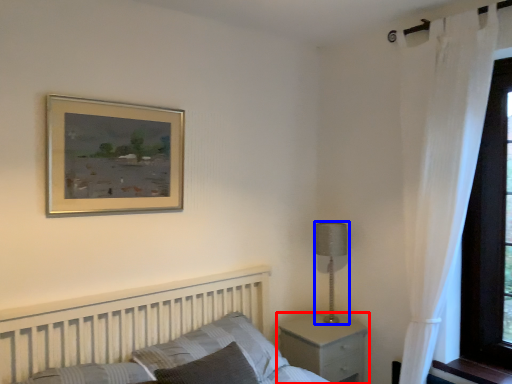
Question: Which object is further to the camera taking this photo, nightstand (highlighted by a red box) or table lamp (highlighted by a blue box)?

Choices:
 (A) nightstand
 (B) table lamp

Answer: (B)